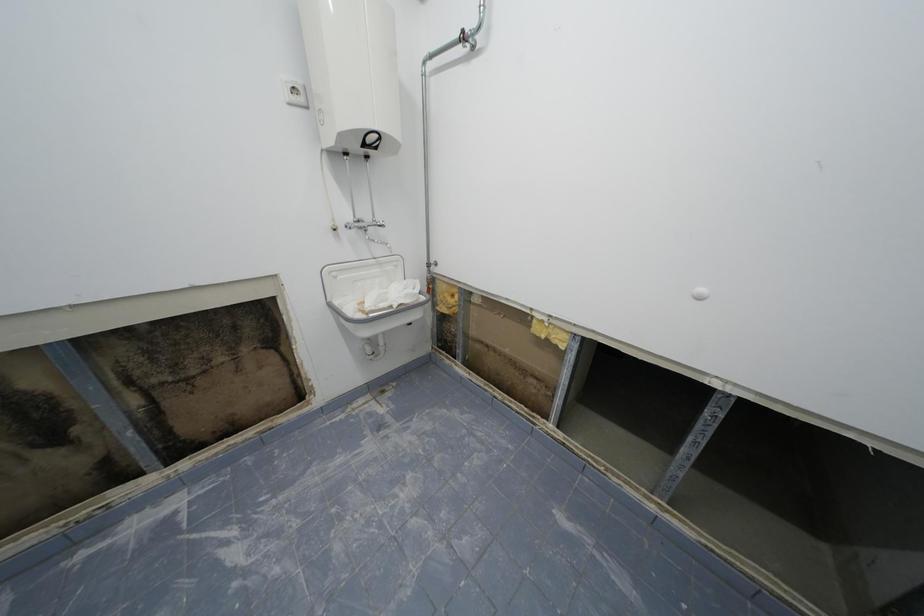
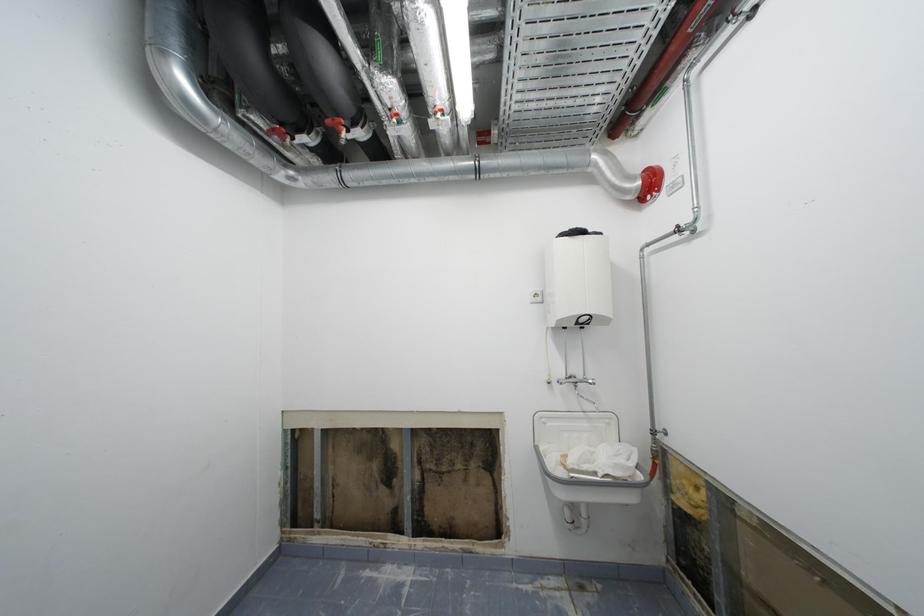
The images are taken continuously from a first-person perspective. In which direction is your viewpoint rotating?

The camera's rotation is toward left-up.